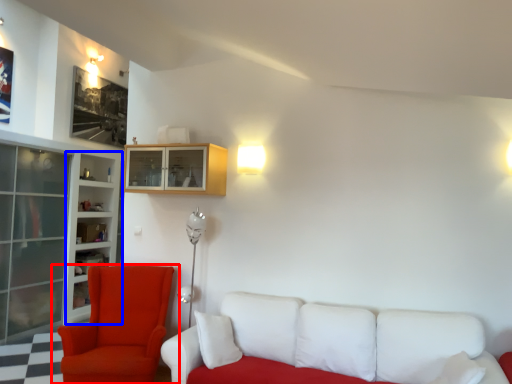
Question: Which of the following is the farthest to the observer, chair (highlighted by a red box) or bookshelf (highlighted by a blue box)?

Choices:
 (A) chair
 (B) bookshelf

Answer: (B)